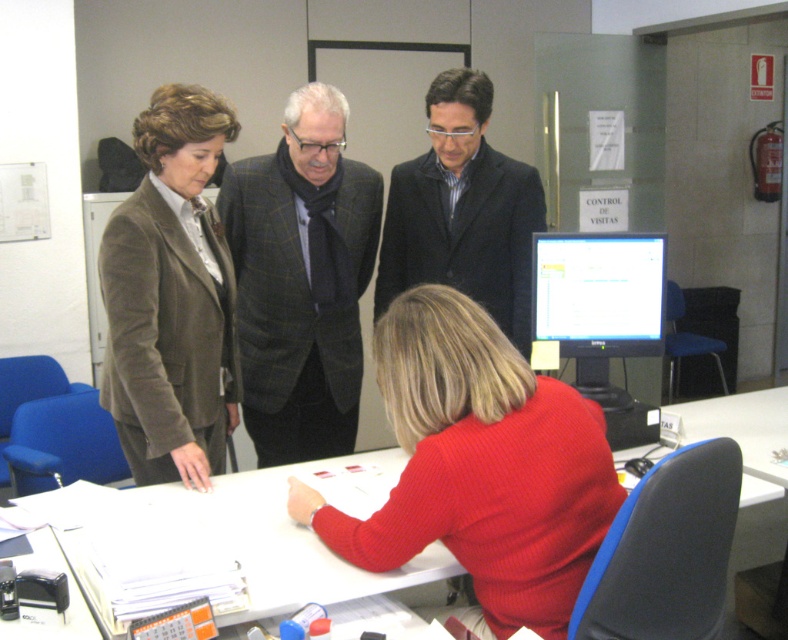
Question: Can you confirm if plaid wool blazer at center is positioned above white glossy table at lower center?

Choices:
 (A) no
 (B) yes

Answer: (B)

Question: Does red sweater at center appear on the left side of black woolen suit at center?

Choices:
 (A) yes
 (B) no

Answer: (A)

Question: Is brown velvety blazer at left wider than white glossy table at lower center?

Choices:
 (A) yes
 (B) no

Answer: (B)

Question: Which point appears farthest from the camera in this image?

Choices:
 (A) (537, 518)
 (B) (255, 477)
 (C) (238, 218)

Answer: (C)

Question: Considering the real-world distances, which object is closest to the plaid wool blazer at center?

Choices:
 (A) white glossy table at lower center
 (B) brown velvety blazer at left
 (C) black woolen suit at center
 (D) red sweater at center

Answer: (C)

Question: Among these points, which one is farthest from the camera?

Choices:
 (A) 288,378
 (B) 125,204

Answer: (A)